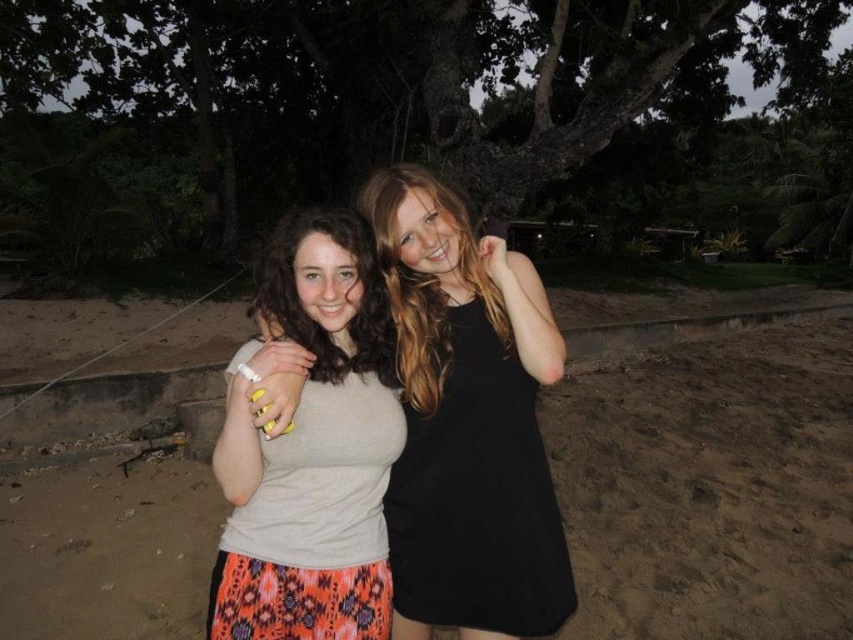
In the scene shown: How far apart are matte gray tank top at center and matte beige tank top at center?

matte gray tank top at center and matte beige tank top at center are 13.02 inches apart from each other.

Does matte gray tank top at center appear under matte beige tank top at center?

Yes, matte gray tank top at center is below matte beige tank top at center.

Is point (419, 500) less distant than point (338, 216)?

No, it is not.

In order to click on matte gray tank top at center in this screenshot , I will do `click(467, 420)`.

Is point (706, 570) in front of point (469, 330)?

No, (706, 570) is behind (469, 330).

Is sandy beach at center wider than matte gray tank top at center?

Indeed, sandy beach at center has a greater width compared to matte gray tank top at center.

Find the location of `sandy beach at center`. sandy beach at center is located at coordinates click(x=706, y=468).

This screenshot has width=853, height=640. I want to click on sandy beach at center, so click(x=706, y=468).

This screenshot has height=640, width=853. I want to click on sandy beach at center, so click(x=706, y=468).